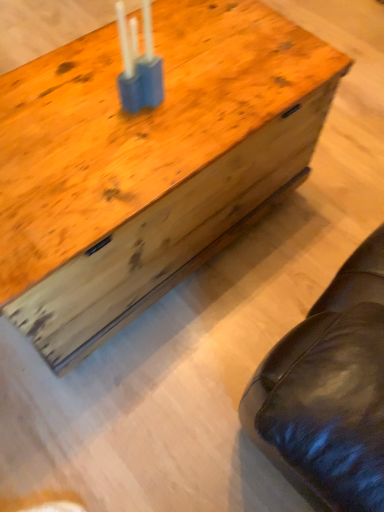
The height and width of the screenshot is (512, 384). Find the location of `free space behind blue plastic candle holder at center`. free space behind blue plastic candle holder at center is located at coordinates pyautogui.click(x=152, y=52).